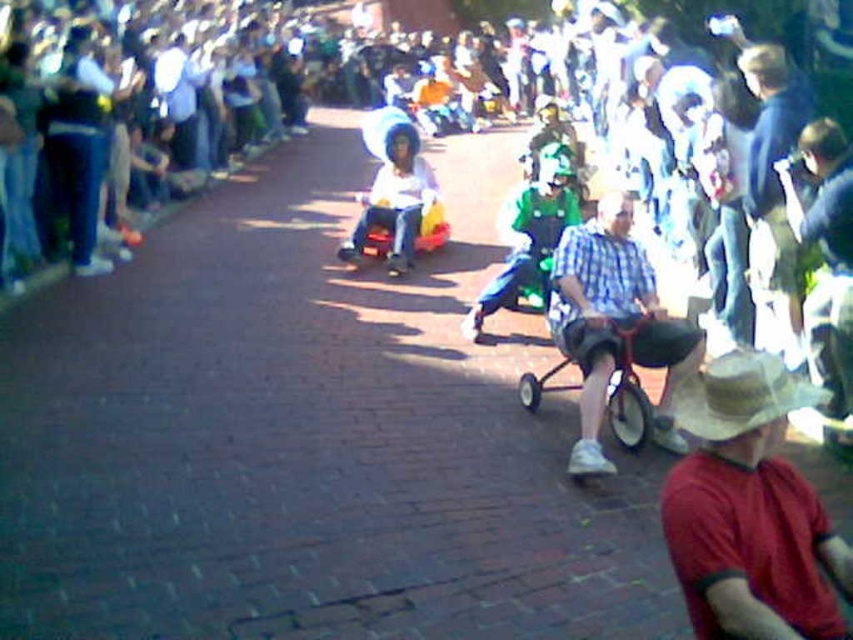
In the scene shown: You are standing at the starting line of the parade route and see two points in the image. Which point is closer to you, point (x=579, y=282) or point (x=376, y=154)?

Point (x=579, y=282) is closer to the viewer than point (x=376, y=154).

You are a photographer at the event and want to capture both the checkered fabric shirt at center and the white cotton shirt at center in a single photo. Which shirt should you focus on to ensure both are in frame without zooming in or out?

You should focus on the checkered fabric shirt at center because it is bigger than the white cotton shirt at center, so keeping it centered will allow the smaller white cotton shirt at center to remain in the frame without needing to adjust the zoom.

You are a photographer trying to capture a photo of the metallic silver stroller at center without including the brown straw cowboy hat at lower right in the frame. Based on their positions, is this possible?

The brown straw cowboy hat at lower right is located above the metallic silver stroller at center, so if you position yourself below the hat and aim upwards, you can capture the stroller without the hat in the frame.